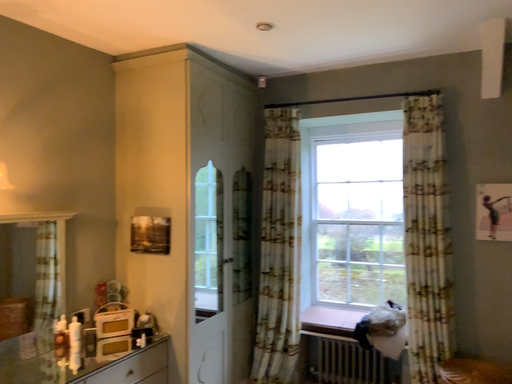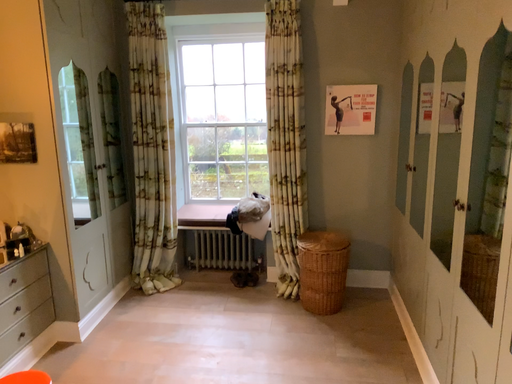
Question: Which way did the camera rotate in the video?

Choices:
 (A) rotated downward
 (B) rotated upward

Answer: (A)